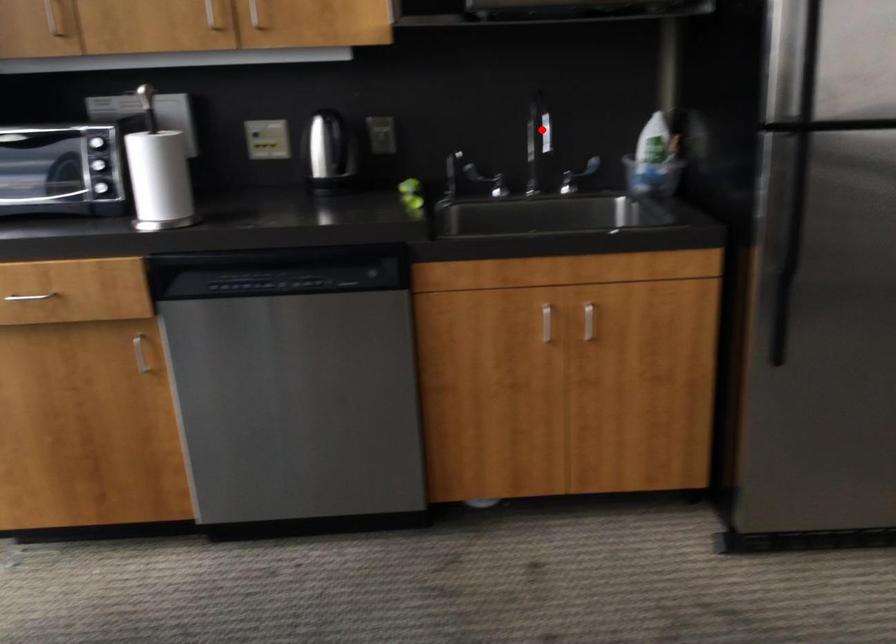
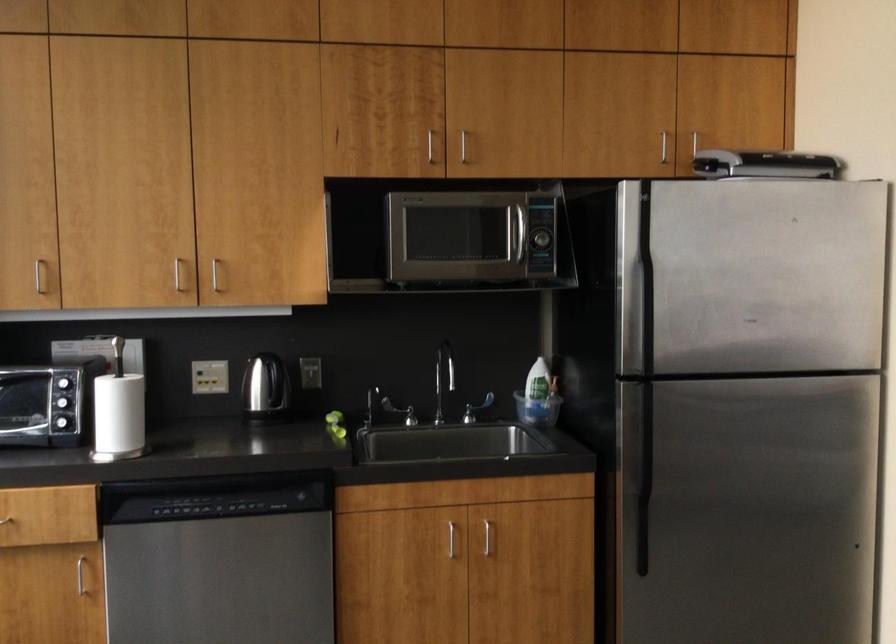
The point at the highlighted location is marked in the first image. Where is the corresponding point in the second image?

(444, 371)